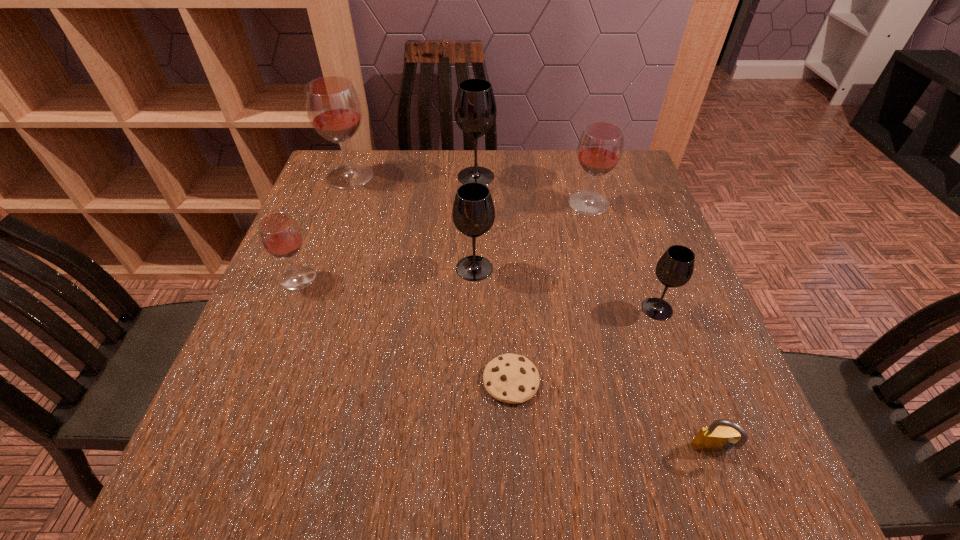
At what (x,y) coordinates should I click in order to perform the action: click on brown cookie. Please return your answer as a coordinate pair (x, y). The image size is (960, 540). Looking at the image, I should click on (510, 378).

You are a GUI agent. You are given a task and a screenshot of the screen. Output one action in this format:
    pyautogui.click(x=<x>, y=<y>)
    Task: Click on the second nearest object
    Image resolution: width=960 pixels, height=540 pixels.
    Given the screenshot: What is the action you would take?
    pyautogui.click(x=510, y=378)

At what (x,y) coordinates should I click in order to perform the action: click on free space located on the left of the biggest gray wineglass. Please return your answer as a coordinate pair (x, y). This screenshot has height=540, width=960. Looking at the image, I should click on (403, 177).

What are the coordinates of `free location located on the right of the farthest red wineglass` in the screenshot? It's located at (485, 177).

Identify the location of free point located on the right of the second farthest red wineglass. (632, 204).

The image size is (960, 540). Identify the location of vacant space situated on the left of the second nearest gray wineglass. (324, 268).

The height and width of the screenshot is (540, 960). Identify the location of free point located 0.380m on the front of the nearest red wineglass. (219, 477).

Where is `vacant space located 0.170m on the front of the nearest gray wineglass`? The width and height of the screenshot is (960, 540). vacant space located 0.170m on the front of the nearest gray wineglass is located at coordinates (690, 399).

Where is `free space located 0.050m on the side with the combination dials of the seventh tallest object`? The width and height of the screenshot is (960, 540). free space located 0.050m on the side with the combination dials of the seventh tallest object is located at coordinates (730, 498).

You are a GUI agent. You are given a task and a screenshot of the screen. Output one action in this format:
    pyautogui.click(x=<x>, y=<y>)
    Task: Click on the vacant space located on the front of the cookie
    
    Given the screenshot: What is the action you would take?
    pyautogui.click(x=517, y=501)